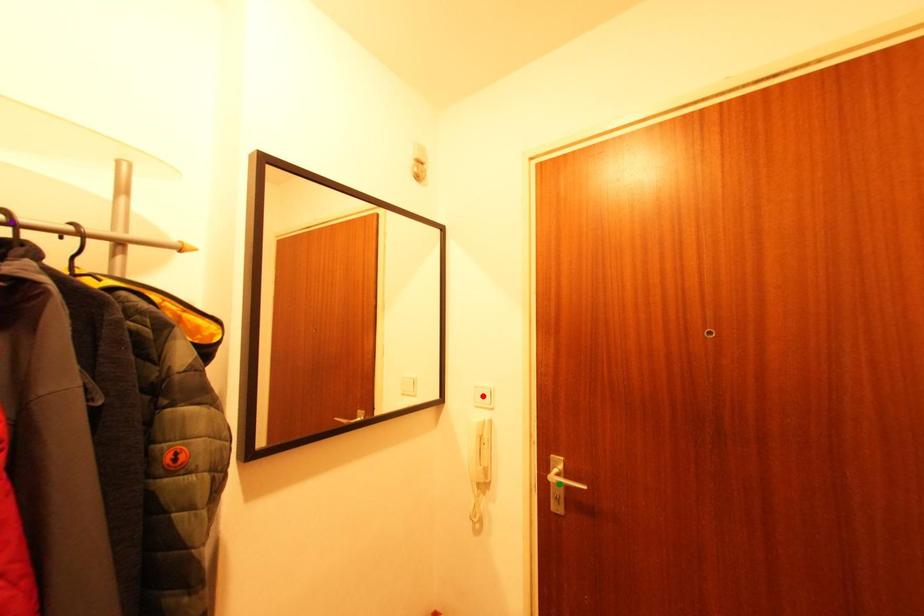
Order these from nearest to farthest:
A) green point
B) red point
C) purple point

purple point, green point, red point